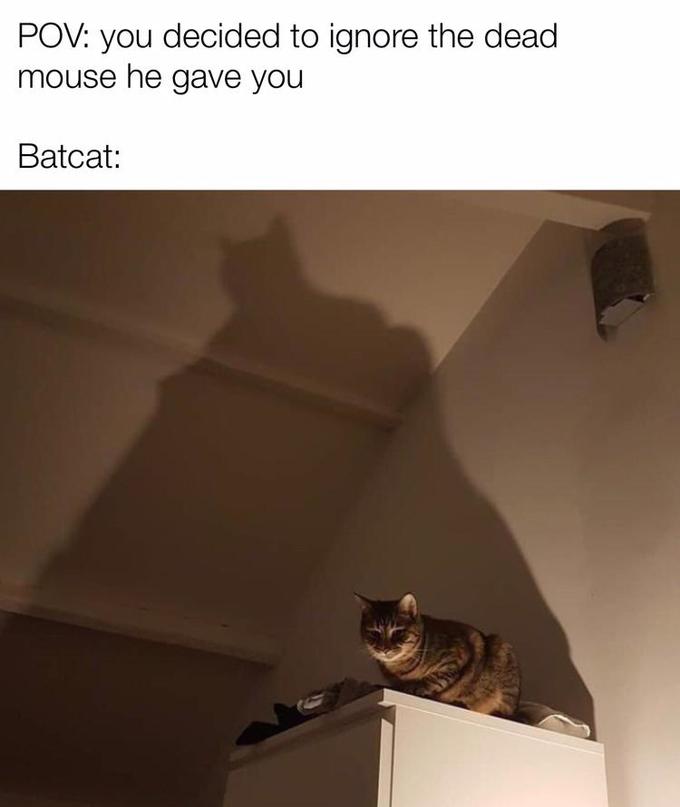
At what (x,y) coordinates should I click in order to perform the action: click on dresser. Please return your answer as a coordinate pair (x, y). The image size is (680, 807). Looking at the image, I should click on (479, 771).